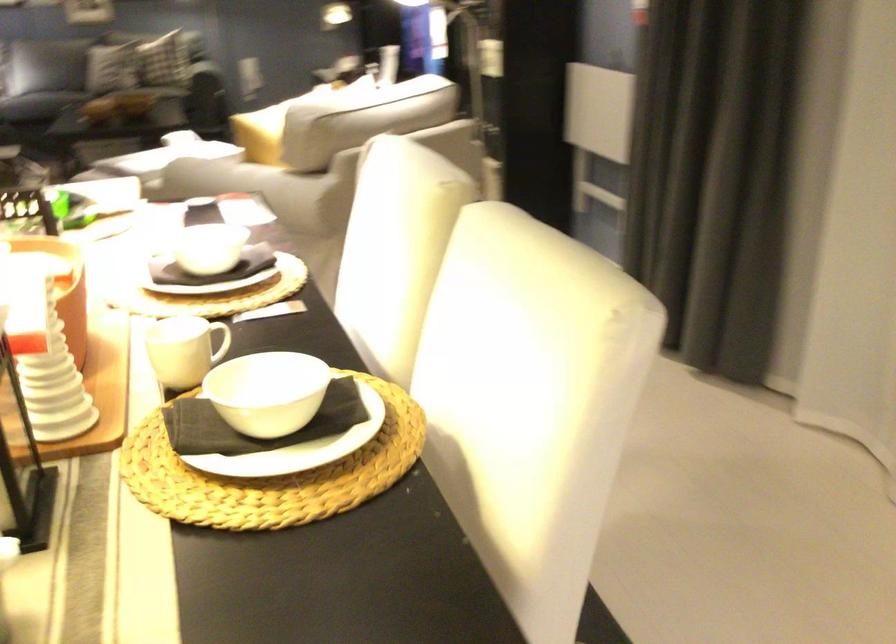
Find where to rest the sofa armrest. Please return your answer as a coordinate pair (x, y).

(264, 185)